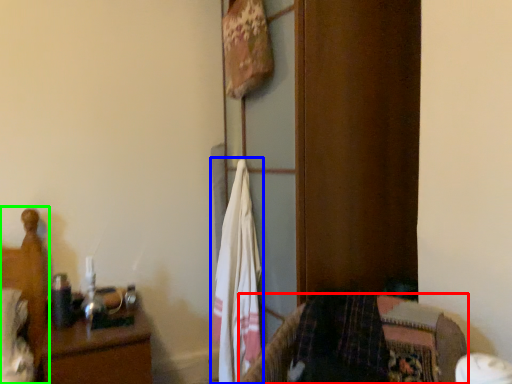
Question: Which object is positioned closest to furniture (highlighted by a red box)? Select from laundry (highlighted by a blue box) and bed (highlighted by a green box).

Choices:
 (A) laundry
 (B) bed

Answer: (A)